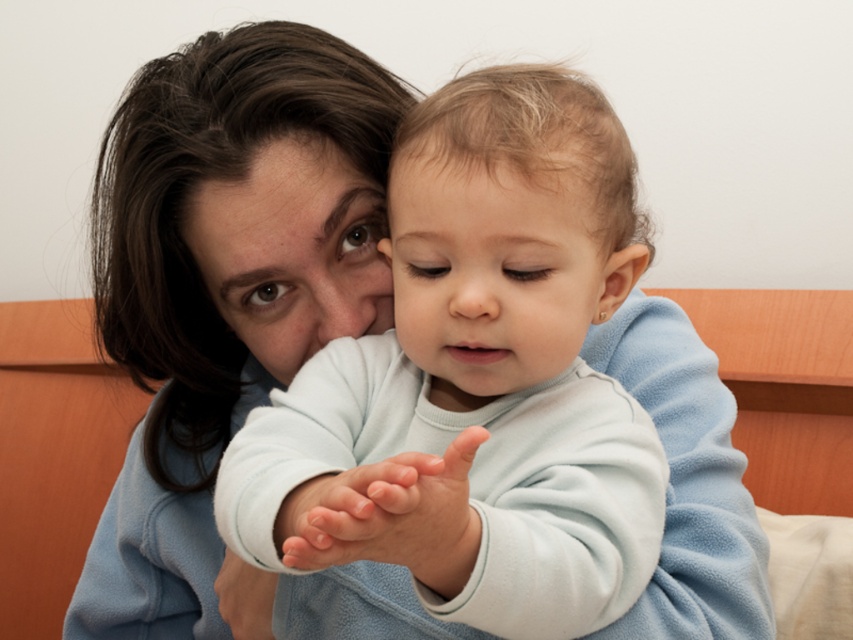
Does light blue fleece at center have a smaller size compared to smooth skin forehead at center?

No, light blue fleece at center is not smaller than smooth skin forehead at center.

Between light blue fleece at center and smooth skin forehead at center, which one appears on the left side from the viewer's perspective?

light blue fleece at center is more to the left.

Is point (519, 324) in front of point (538, 188)?

No, it is behind (538, 188).

Identify the location of light blue fleece at center. [476, 380].

Is smooth white hand at center smaller than smooth skin forehead at center?

No, smooth white hand at center is not smaller than smooth skin forehead at center.

Is smooth white hand at center bigger than smooth skin forehead at center?

Indeed, smooth white hand at center has a larger size compared to smooth skin forehead at center.

Who is more forward, (438,518) or (558,157)?

Point (438,518) is more forward.

The height and width of the screenshot is (640, 853). Identify the location of smooth white hand at center. (387, 516).

Can you confirm if smooth skin forehead at center is shorter than smooth skin hand at center?

Yes, smooth skin forehead at center is shorter than smooth skin hand at center.

Which is in front, point (431, 134) or point (250, 621)?

Point (431, 134)

Does point (440, 177) come farther from viewer compared to point (244, 563)?

No, it is in front of (244, 563).

The image size is (853, 640). I want to click on smooth skin forehead at center, so click(494, 192).